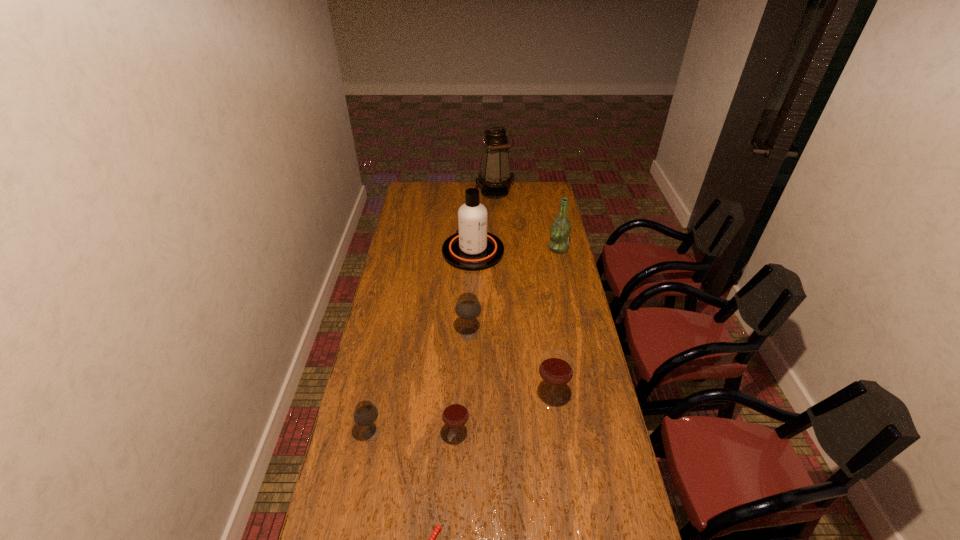
Where is `vacant region that satisfies the following two spatial constraints: 1. on the back side of the farthest object; 2. on the right side of the farther gray wineglass`? This screenshot has height=540, width=960. vacant region that satisfies the following two spatial constraints: 1. on the back side of the farthest object; 2. on the right side of the farther gray wineglass is located at coordinates (472, 192).

Locate an element on the screen. The width and height of the screenshot is (960, 540). free space that satisfies the following two spatial constraints: 1. on the front side of the rightmost wineglass; 2. on the left side of the brown oil lamp is located at coordinates (505, 399).

The height and width of the screenshot is (540, 960). Find the location of `vacant space that satisfies the following two spatial constraints: 1. on the back side of the rightmost wineglass; 2. on the left side of the smaller red wineglass`. vacant space that satisfies the following two spatial constraints: 1. on the back side of the rightmost wineglass; 2. on the left side of the smaller red wineglass is located at coordinates (459, 399).

Where is `free space that satisfies the following two spatial constraints: 1. on the surface of the green beer bottle; 2. on the front side of the nearer red wineglass`? The width and height of the screenshot is (960, 540). free space that satisfies the following two spatial constraints: 1. on the surface of the green beer bottle; 2. on the front side of the nearer red wineglass is located at coordinates (599, 436).

Image resolution: width=960 pixels, height=540 pixels. In order to click on vacant point that satisfies the following two spatial constraints: 1. on the back side of the fourth nearest object; 2. on the right side of the smaller gray wineglass in this screenshot , I will do `click(378, 399)`.